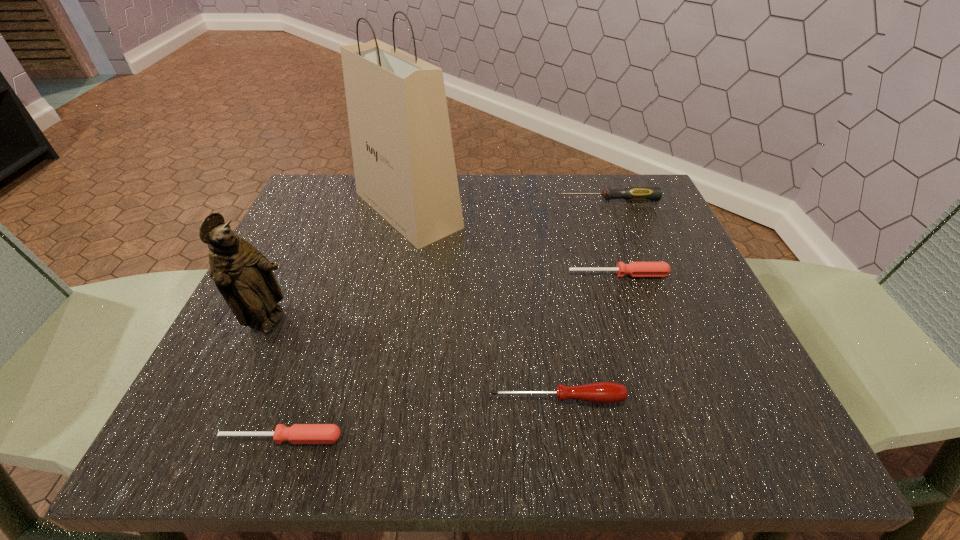
At what (x,y) coordinates should I click in order to perform the action: click on vacant region located insert the farthest screwdriver into a screw head. Please return your answer as a coordinate pair (x, y). The height and width of the screenshot is (540, 960). Looking at the image, I should click on (502, 200).

Where is `vacant area situated insert the farthest screwdriver into a screw head`? vacant area situated insert the farthest screwdriver into a screw head is located at coordinates (486, 200).

Identify the location of vacant region located 0.120m insert the farthest screwdriver into a screw head. (507, 200).

Locate an element on the screen. vacant point located on the left of the fifth farthest object is located at coordinates (305, 399).

This screenshot has height=540, width=960. I want to click on free region located 0.230m on the left of the fourth nearest object, so click(448, 274).

Locate an element on the screen. Image resolution: width=960 pixels, height=540 pixels. free location located on the right of the shortest object is located at coordinates (597, 438).

Where is `shopping bag at the far edge`? shopping bag at the far edge is located at coordinates (403, 157).

Find the location of a particular element. The height and width of the screenshot is (540, 960). screwdriver located in the far edge section of the desktop is located at coordinates (630, 193).

You are a GUI agent. You are given a task and a screenshot of the screen. Output one action in this format:
    pyautogui.click(x=<x>, y=<y>)
    Task: Click on the shopping bag present at the left edge
    
    Given the screenshot: What is the action you would take?
    pyautogui.click(x=403, y=157)

The height and width of the screenshot is (540, 960). Identify the location of figurine present at the left edge. point(243,275).